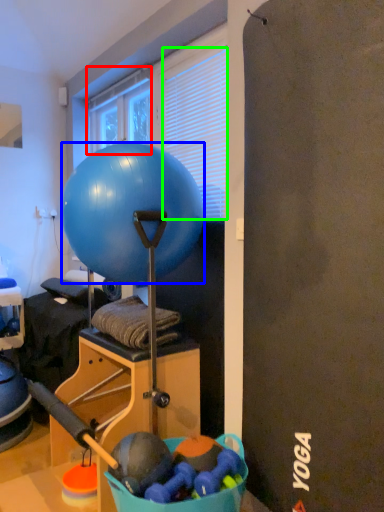
Question: Considering the real-world distances, which object is closest to window (highlighted by a red box)? ball (highlighted by a blue box) or blind (highlighted by a green box).

Choices:
 (A) ball
 (B) blind

Answer: (B)